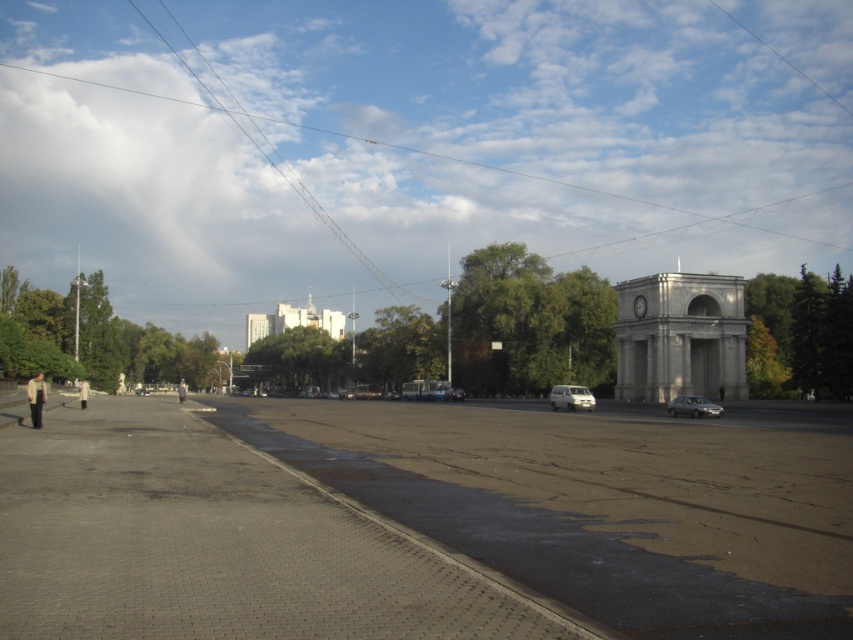
Question: Among these points, which one is farthest from the camera?

Choices:
 (A) (45, 515)
 (B) (679, 406)
 (C) (635, 611)

Answer: (B)

Question: Which of the following is the closest to the observer?

Choices:
 (A) white matte van at center
 (B) silver metallic sedan at center
 (C) green leafy tree at left
 (D) green leafy tree at right

Answer: (B)

Question: Considering the relative positions of gray concrete pavement at lower left and silver metallic sedan at center in the image provided, where is gray concrete pavement at lower left located with respect to silver metallic sedan at center?

Choices:
 (A) below
 (B) above

Answer: (B)

Question: Can you confirm if green leafy tree at left is thinner than light beige coat at lower left?

Choices:
 (A) yes
 (B) no

Answer: (B)

Question: Does gray concrete pavement at lower left have a greater width compared to light gray fabric person at center?

Choices:
 (A) no
 (B) yes

Answer: (A)

Question: Which point is farther from the camera taking this photo?

Choices:
 (A) (579, 397)
 (B) (27, 301)
 (C) (686, 401)
 (D) (705, 557)

Answer: (B)